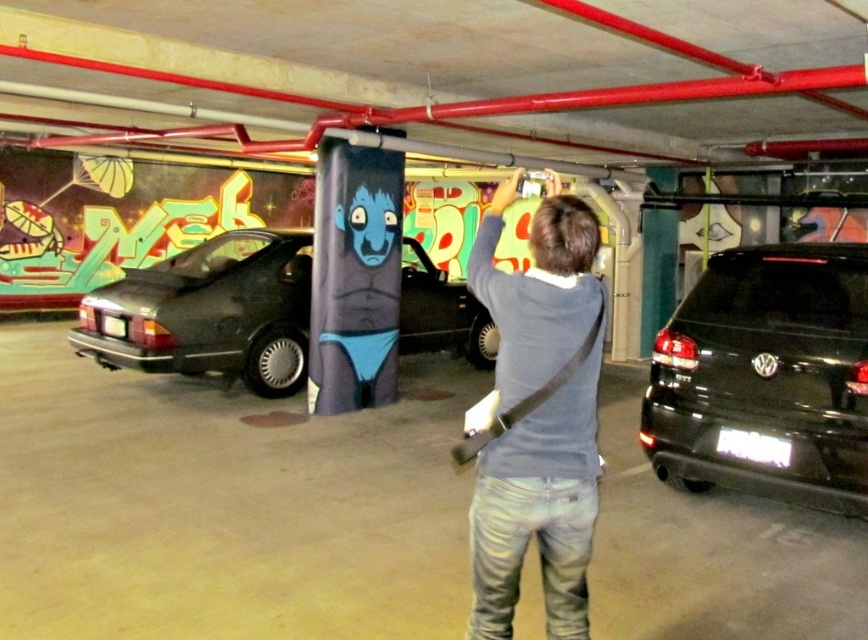
You are a photographer trying to capture a clear shot of the black matte car at left without any obstructions. The person wearing the dark blue sweater at center is currently blocking your view. Can you move the person to the side to get an unobstructed view of the car?

The dark blue sweater at center is in front of the black matte car at left, so moving the person wearing the dark blue sweater at center to the side would allow you to see the black matte car at left without obstruction.

You are a photographer trying to capture the entire scene of the black matte suv at right and the black matte car at left. Given that your camera has a fixed focal length, which vehicle should you position closer to ensure both are fully in frame?

Since the black matte suv at right is not as tall as the black matte car at left, you should position the camera closer to the black matte suv at right to ensure both vehicles are fully in frame without cropping either.

You are standing at the point marked as point (518, 273) in the parking garage. If you want to take a photo of the ceiling beams, which are located above you, would your current position allow you to capture them in your shot?

The point (518, 273) is 10.48 feet away from the viewer. Since the ceiling beams are above you, your current position allows you to capture them in your shot as long as your camera angle can look upward.